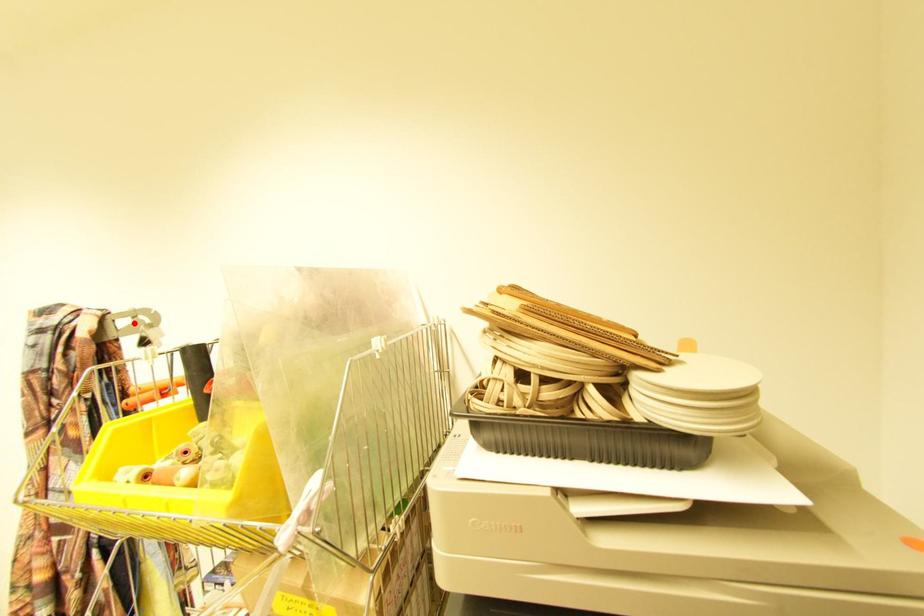
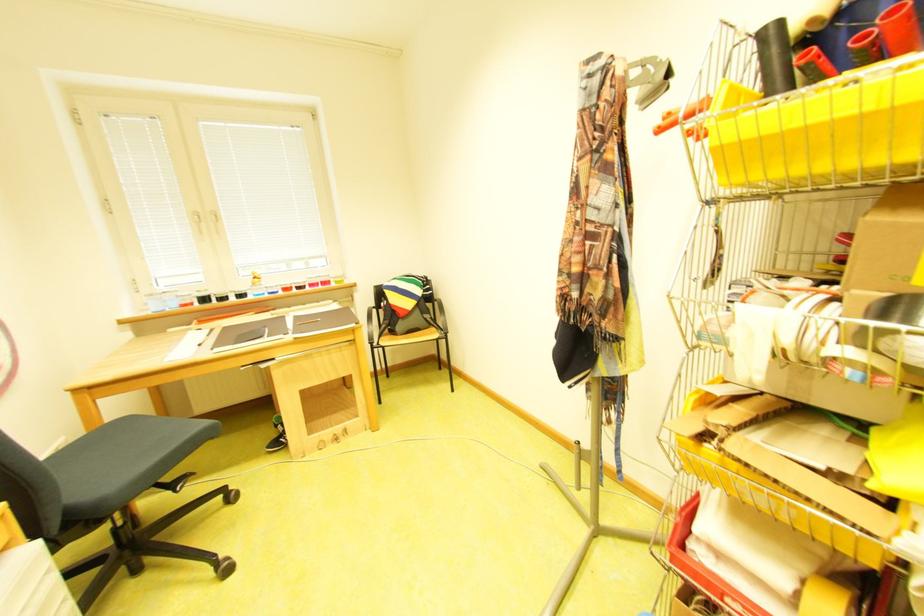
Find the pixel in the second image that matches the highlighted location in the first image.

(646, 74)